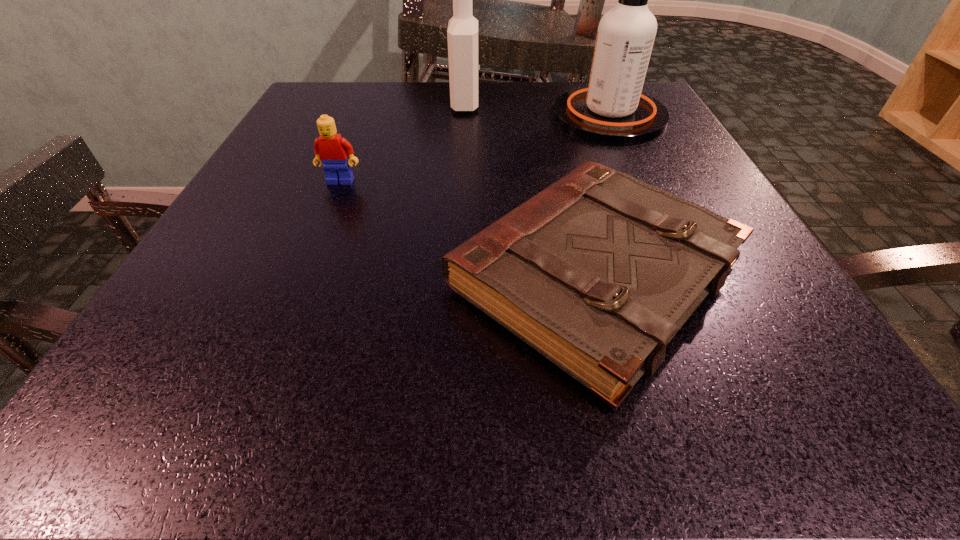
This screenshot has height=540, width=960. What are the coordinates of `object that is at the near edge` in the screenshot? It's located at (597, 272).

Where is `object present at the left edge`? object present at the left edge is located at coordinates (332, 150).

Image resolution: width=960 pixels, height=540 pixels. I want to click on cleansing agent that is at the right edge, so click(612, 109).

Where is `hardback book that is at the right edge`? This screenshot has height=540, width=960. hardback book that is at the right edge is located at coordinates (597, 272).

Identify the location of object that is at the far right corner. The image size is (960, 540). (612, 109).

What are the coordinates of `object positioned at the near right corner` in the screenshot? It's located at (597, 272).

Where is `vacant space at the far edge of the desktop`? The width and height of the screenshot is (960, 540). vacant space at the far edge of the desktop is located at coordinates (543, 122).

Where is `free space at the left edge of the desktop`? This screenshot has width=960, height=540. free space at the left edge of the desktop is located at coordinates (151, 360).

This screenshot has height=540, width=960. I want to click on free region at the right edge of the desktop, so coord(763,291).

Locate an element on the screen. The image size is (960, 540). vacant space at the far left corner of the desktop is located at coordinates (346, 98).